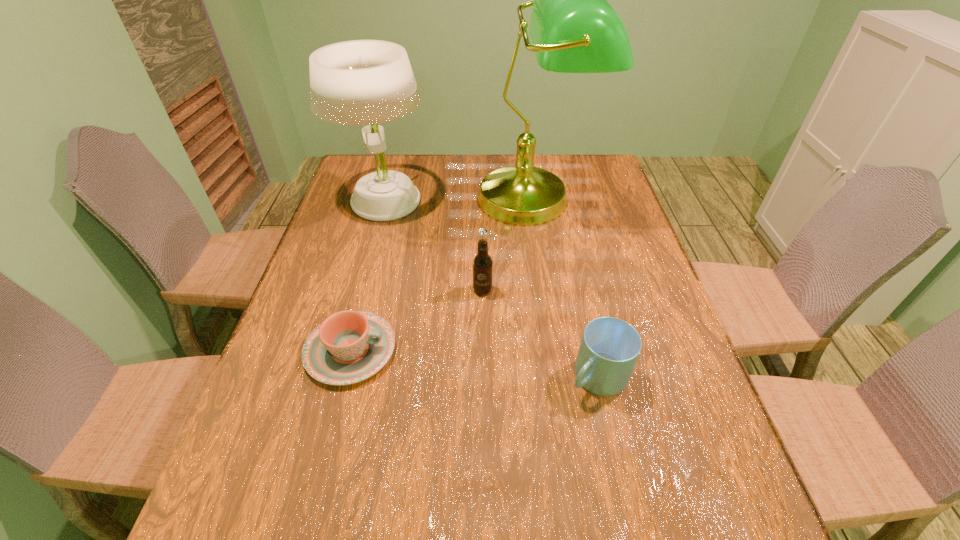
This screenshot has width=960, height=540. What are the coordinates of `the taller lamp` in the screenshot? It's located at (573, 29).

At what (x,y) coordinates should I click in order to perform the action: click on the right lamp. Please return your answer as a coordinate pair (x, y). Looking at the image, I should click on (573, 29).

Find the location of a particular element. The width and height of the screenshot is (960, 540). the second tallest object is located at coordinates (360, 82).

Find the location of a particular element. The width and height of the screenshot is (960, 540). the left lamp is located at coordinates (360, 82).

The width and height of the screenshot is (960, 540). Find the location of `the third farthest object`. the third farthest object is located at coordinates (482, 262).

Find the location of a particular element. This screenshot has width=960, height=540. the third tallest object is located at coordinates 482,262.

Identify the location of mug. (609, 349).

You are a GUI agent. You are given a task and a screenshot of the screen. Output one action in this format:
    pyautogui.click(x=<x>, y=<y>)
    Task: Click on the chinaware
    This screenshot has height=540, width=960.
    Given the screenshot: What is the action you would take?
    pyautogui.click(x=348, y=347)

Where is `blank space located 0.190m on the desk next to the right lamp`? blank space located 0.190m on the desk next to the right lamp is located at coordinates (547, 286).

Find the location of a particular element. The width and height of the screenshot is (960, 540). vacant space located 0.340m on the front-facing side of the left lamp is located at coordinates (353, 316).